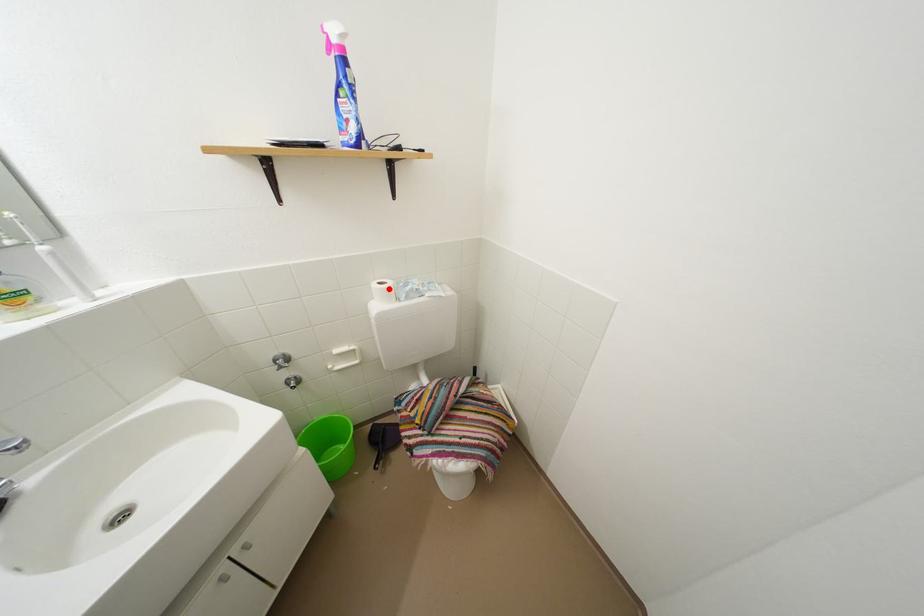
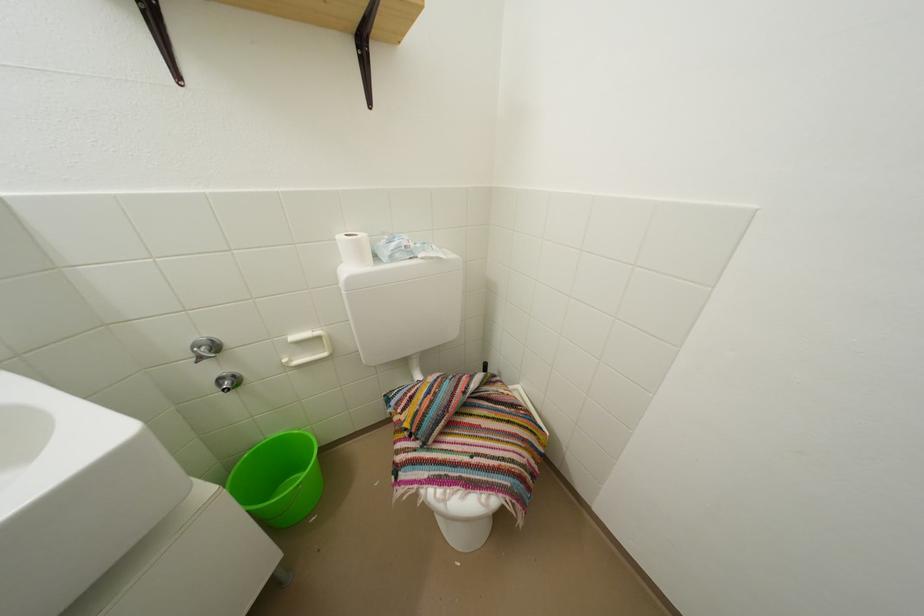
Locate, in the second image, the point that corresponds to the highlighted location in the first image.

(360, 240)